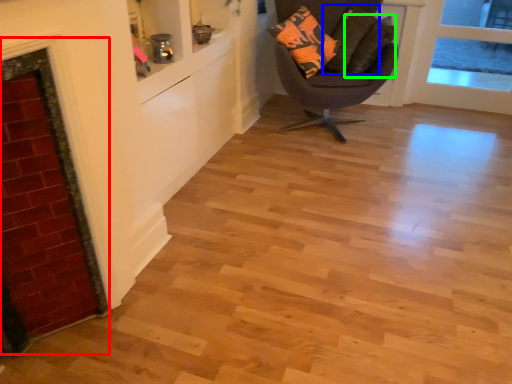
Question: Which object is positioned closest to fireplace (highlighted by a red box)? Select from pillow (highlighted by a blue box) and pillow (highlighted by a green box).

Choices:
 (A) pillow
 (B) pillow

Answer: (B)